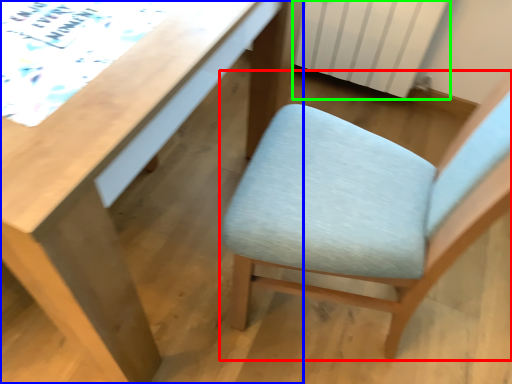
Question: Based on their relative distances, which object is farther from chair (highlighted by a red box)? Choose from desk (highlighted by a blue box) and radiator (highlighted by a green box).

Choices:
 (A) desk
 (B) radiator

Answer: (B)